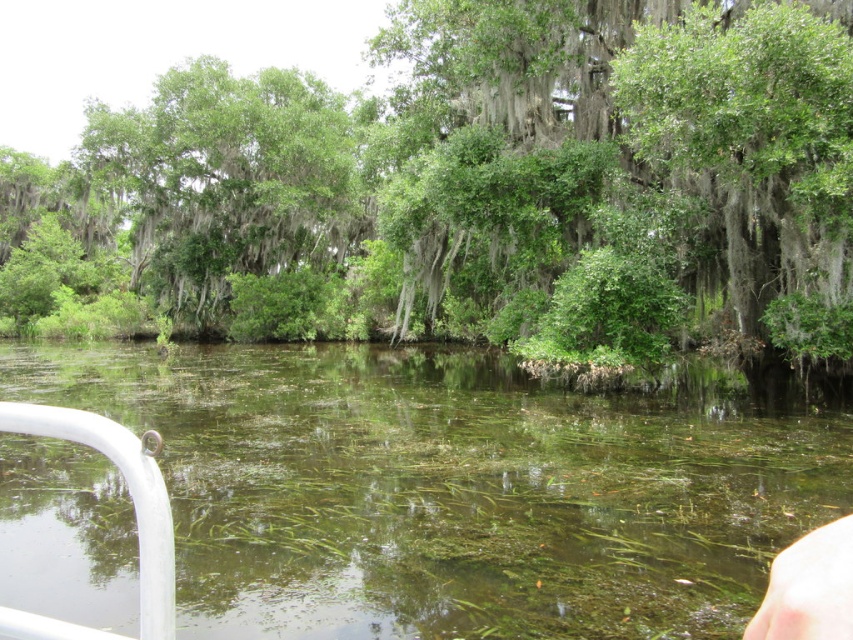
You are standing on the boat and want to reach the clear water at lower center. The green leafy tree at center is blocking your path. Can you walk around it?

The green leafy tree at center is 43.98 feet away from the clear water at lower center. Since the tree is blocking the path, you can walk around it as there is enough space between them to navigate around.

You are standing on the boat and want to reach the skinny white hand at lower right without touching the green leafy tree at center. Which direction should you move?

The green leafy tree at center is closer to you than the skinny white hand at lower right. To avoid touching the tree, move towards the direction away from the green leafy tree at center towards the skinny white hand at lower right.